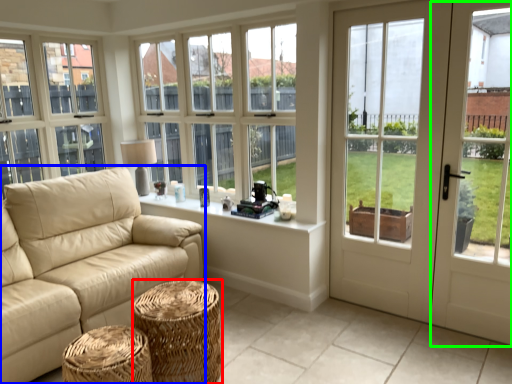
Question: Based on their relative distances, which object is farther from stool (highlighted by a red box)? Choose from studio couch (highlighted by a blue box) and screen door (highlighted by a green box).

Choices:
 (A) studio couch
 (B) screen door

Answer: (B)